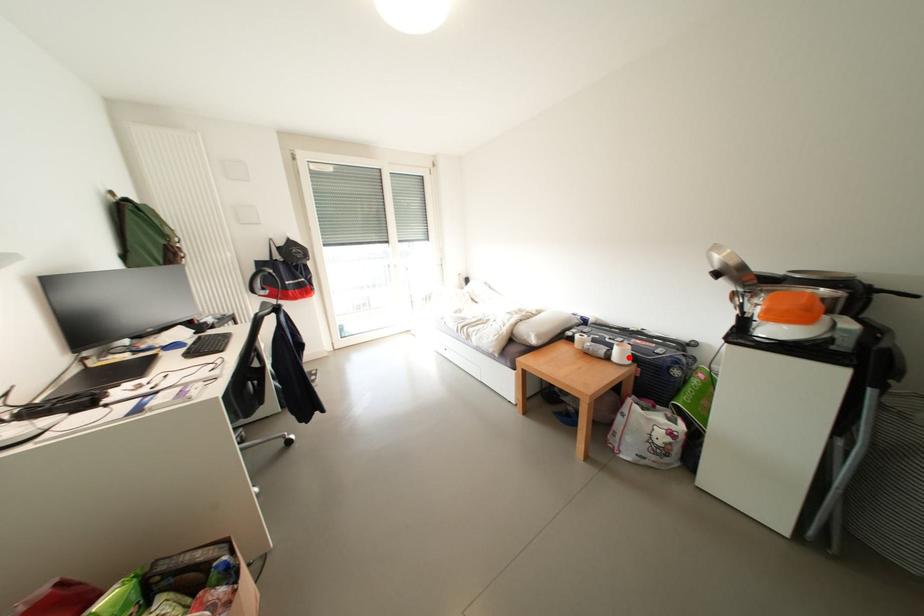
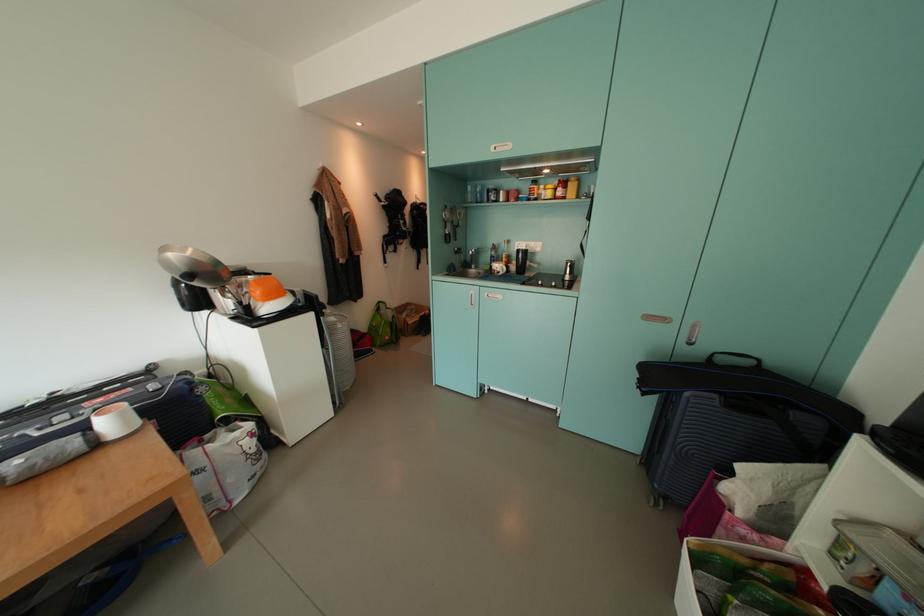
Question: I am providing you with two images of the same scene from different viewpoints. A red point is marked on the first image. Can you still see the location of the red point in image 2?

Choices:
 (A) Yes
 (B) No

Answer: (A)